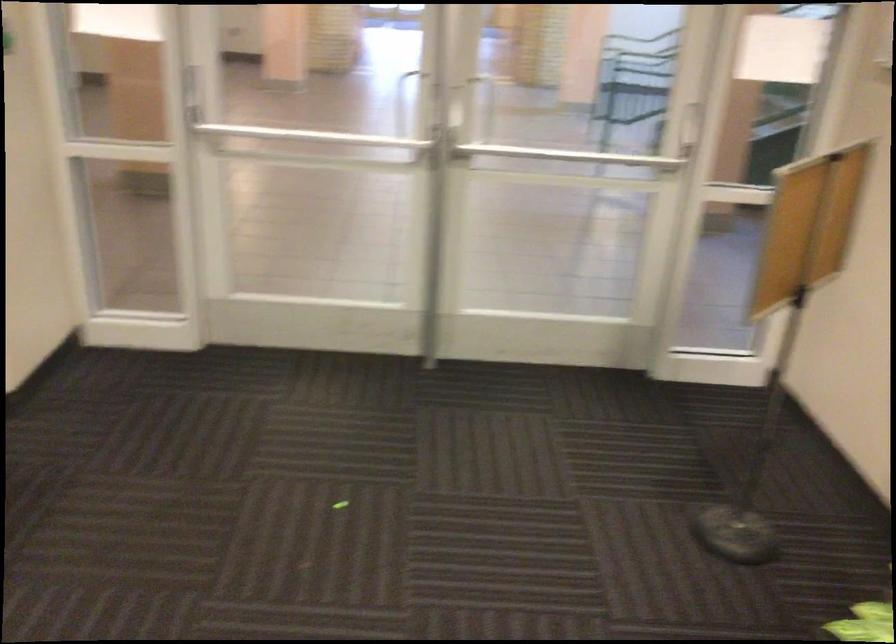
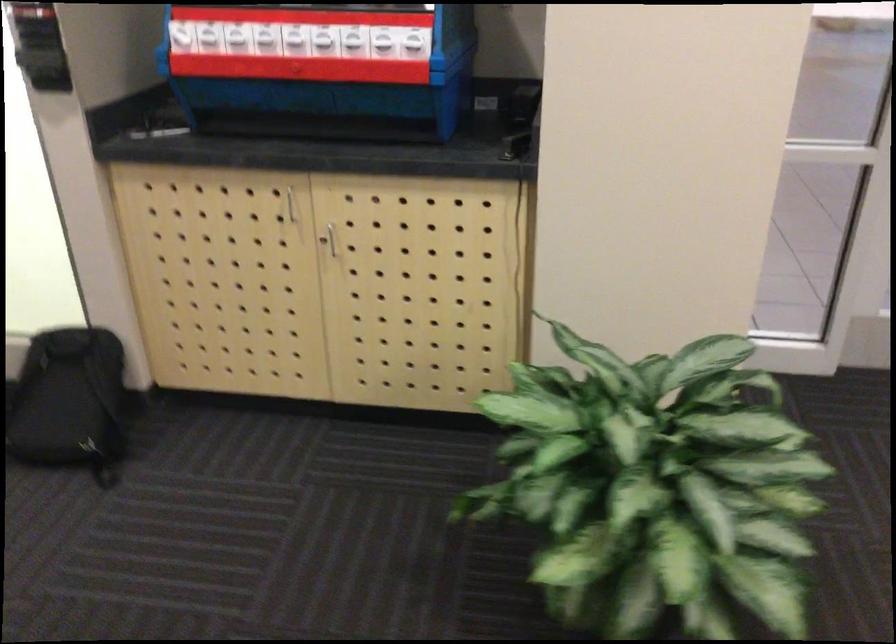
Question: Which direction would the cameraman need to move to produce the second image? Reply with the corresponding letter.

Choices:
 (A) Left
 (B) Right
 (C) Forward
 (D) Backward

Answer: (A)